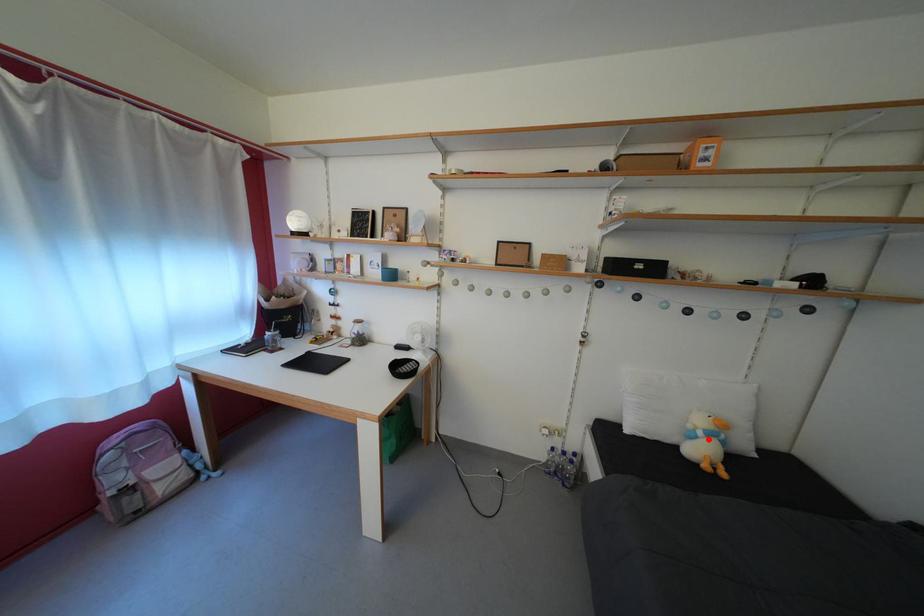
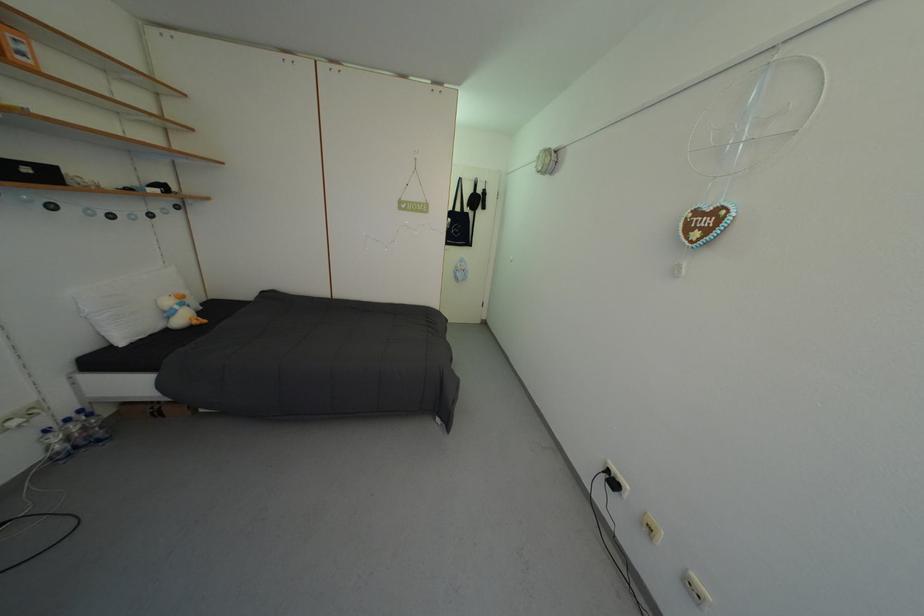
Where in the second image is the point corresponding to the highlighted location from the first image?

(186, 313)